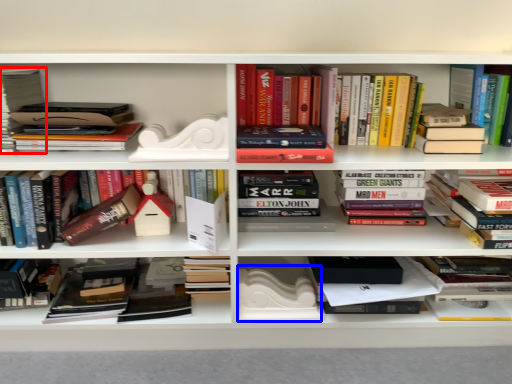
Question: Which object is further to the camera taking this photo, book (highlighted by a red box) or paperback book (highlighted by a blue box)?

Choices:
 (A) book
 (B) paperback book

Answer: (B)